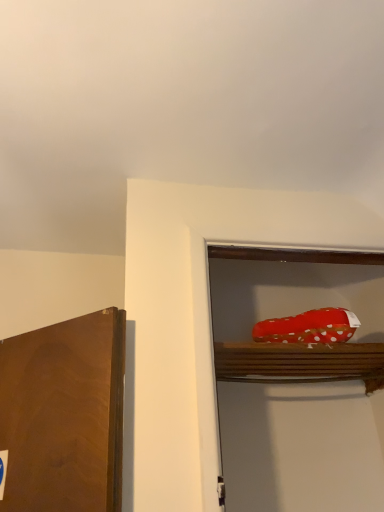
Question: Is polka dot fabric shoe at upper right bigger or smaller than red polka dot fabric at upper right?

Choices:
 (A) small
 (B) big

Answer: (B)

Question: Is polka dot fabric shoe at upper right taller or shorter than red polka dot fabric at upper right?

Choices:
 (A) short
 (B) tall

Answer: (B)

Question: In terms of width, does polka dot fabric shoe at upper right look wider or thinner when compared to red polka dot fabric at upper right?

Choices:
 (A) wide
 (B) thin

Answer: (A)

Question: Is red polka dot fabric at upper right wider or thinner than polka dot fabric shoe at upper right?

Choices:
 (A) thin
 (B) wide

Answer: (A)

Question: From the image's perspective, relative to polka dot fabric shoe at upper right, is red polka dot fabric at upper right above or below?

Choices:
 (A) above
 (B) below

Answer: (A)

Question: From a real-world perspective, is red polka dot fabric at upper right above or below polka dot fabric shoe at upper right?

Choices:
 (A) above
 (B) below

Answer: (A)

Question: Is red polka dot fabric at upper right inside or outside of polka dot fabric shoe at upper right?

Choices:
 (A) inside
 (B) outside

Answer: (B)